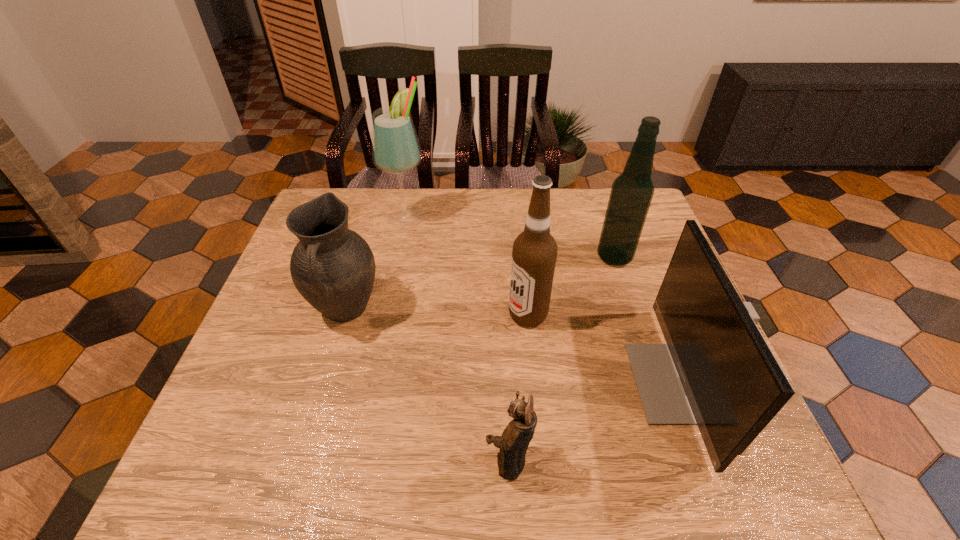
I want to click on blank area located on the label of the second alcohol from left to right, so click(x=471, y=315).

This screenshot has width=960, height=540. I want to click on vacant point located on the label of the second alcohol from left to right, so [x=386, y=315].

Identify the location of vacant position located on the label of the second alcohol from left to right. The image size is (960, 540). (406, 315).

Where is `vacant region located on the side of the pitcher with the handle`? This screenshot has height=540, width=960. vacant region located on the side of the pitcher with the handle is located at coordinates (322, 392).

At what (x,y) coordinates should I click in order to perform the action: click on free space located 0.100m on the screen of the computer monitor. Please return your answer as a coordinate pair (x, y). This screenshot has height=540, width=960. Looking at the image, I should click on (588, 382).

Where is `free space located 0.290m on the screen of the computer monitor`? free space located 0.290m on the screen of the computer monitor is located at coordinates (500, 382).

At what (x,y) coordinates should I click in order to perform the action: click on vacant space located on the screen of the computer monitor. Please return your answer as a coordinate pair (x, y). This screenshot has height=540, width=960. Looking at the image, I should click on (565, 382).

Identify the location of vacant region located 0.320m on the front-facing side of the figurine. This screenshot has width=960, height=540. (314, 461).

Where is `free region located on the front-facing side of the figurine`? free region located on the front-facing side of the figurine is located at coordinates (372, 461).

In order to click on vacant space located on the front-facing side of the figurine in this screenshot , I will do `click(426, 461)`.